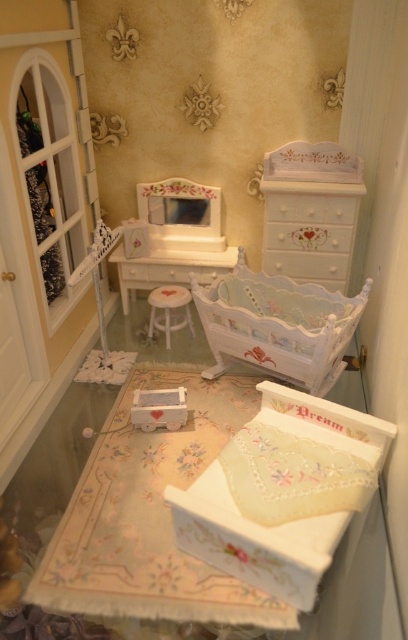
Question: Can you confirm if white glossy drawer at upper center is positioned above white glossy drawer at center?

Choices:
 (A) no
 (B) yes

Answer: (B)

Question: Does white glossy drawers at center have a lesser width compared to matte white dresser at center?

Choices:
 (A) no
 (B) yes

Answer: (B)

Question: Does white painted wood dresser at upper center have a lesser width compared to white glossy drawer at upper center?

Choices:
 (A) no
 (B) yes

Answer: (A)

Question: Which object is the closest to the pastel painted crib at center?

Choices:
 (A) white glossy drawers at center
 (B) white glossy drawer at center
 (C) white painted wood dresser at upper center
 (D) matte white dresser at center

Answer: (A)

Question: Estimate the real-world distances between objects in this image. Which object is closer to the matte white dresser at center?

Choices:
 (A) white glossy drawer at center
 (B) white painted wood dresser at upper center

Answer: (A)

Question: Which object appears closest to the camera in this image?

Choices:
 (A) white fabric stool at center
 (B) white painted wood dresser at upper center

Answer: (B)